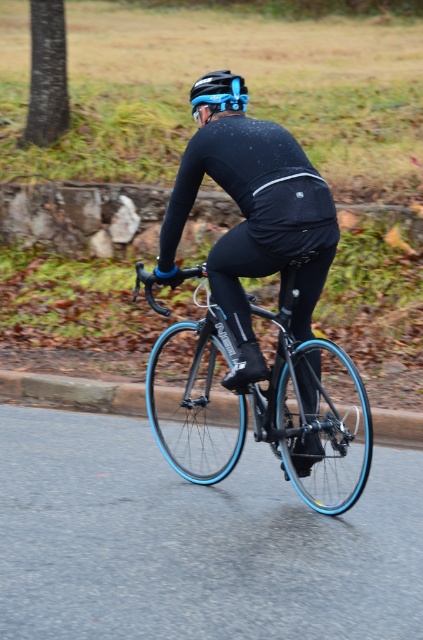
Question: Among these points, which one is nearest to the camera?

Choices:
 (A) (299, 346)
 (B) (274, 250)

Answer: (B)

Question: Is matte black cycling suit at center positioned behind blue glossy bicycle at center?

Choices:
 (A) yes
 (B) no

Answer: (A)

Question: Can you confirm if matte black cycling suit at center is bigger than blue matte bicycle helmet at upper center?

Choices:
 (A) no
 (B) yes

Answer: (B)

Question: Is matte black cycling suit at center positioned in front of blue matte bicycle helmet at upper center?

Choices:
 (A) no
 (B) yes

Answer: (B)

Question: Which point is farther from the camera taking this photo?

Choices:
 (A) (264, 433)
 (B) (260, 225)
 (C) (230, 84)

Answer: (C)

Question: Which object is closer to the camera taking this photo?

Choices:
 (A) matte black cycling suit at center
 (B) blue matte bicycle helmet at upper center
 (C) blue glossy bicycle at center

Answer: (C)